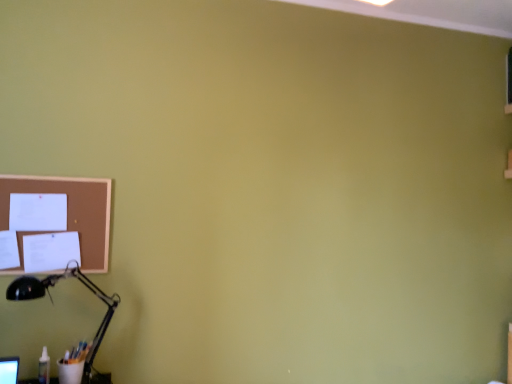
Question: Is black matte desk lamp at lower left oriented away from brown corkboard at upper left?

Choices:
 (A) yes
 (B) no

Answer: (B)

Question: Can brown corkboard at upper left be found inside black matte desk lamp at lower left?

Choices:
 (A) no
 (B) yes

Answer: (A)

Question: Can you confirm if black matte desk lamp at lower left is thinner than brown corkboard at upper left?

Choices:
 (A) yes
 (B) no

Answer: (B)

Question: From the image's perspective, is black matte desk lamp at lower left above brown corkboard at upper left?

Choices:
 (A) no
 (B) yes

Answer: (A)

Question: From the image's perspective, is black matte desk lamp at lower left below brown corkboard at upper left?

Choices:
 (A) yes
 (B) no

Answer: (A)

Question: Does black matte desk lamp at lower left have a greater height compared to brown corkboard at upper left?

Choices:
 (A) yes
 (B) no

Answer: (A)

Question: Considering the relative sizes of brown corkboard at upper left and black matte desk lamp at lower left in the image provided, is brown corkboard at upper left smaller than black matte desk lamp at lower left?

Choices:
 (A) yes
 (B) no

Answer: (A)

Question: Is brown corkboard at upper left taller than black matte desk lamp at lower left?

Choices:
 (A) no
 (B) yes

Answer: (A)

Question: From a real-world perspective, is brown corkboard at upper left physically above black matte desk lamp at lower left?

Choices:
 (A) yes
 (B) no

Answer: (A)

Question: Does brown corkboard at upper left have a larger size compared to black matte desk lamp at lower left?

Choices:
 (A) no
 (B) yes

Answer: (A)

Question: Does brown corkboard at upper left appear on the left side of black matte desk lamp at lower left?

Choices:
 (A) no
 (B) yes

Answer: (B)

Question: From the image's perspective, does brown corkboard at upper left appear higher than black matte desk lamp at lower left?

Choices:
 (A) yes
 (B) no

Answer: (A)

Question: From the image's perspective, is brown corkboard at upper left positioned above or below black matte desk lamp at lower left?

Choices:
 (A) below
 (B) above

Answer: (B)